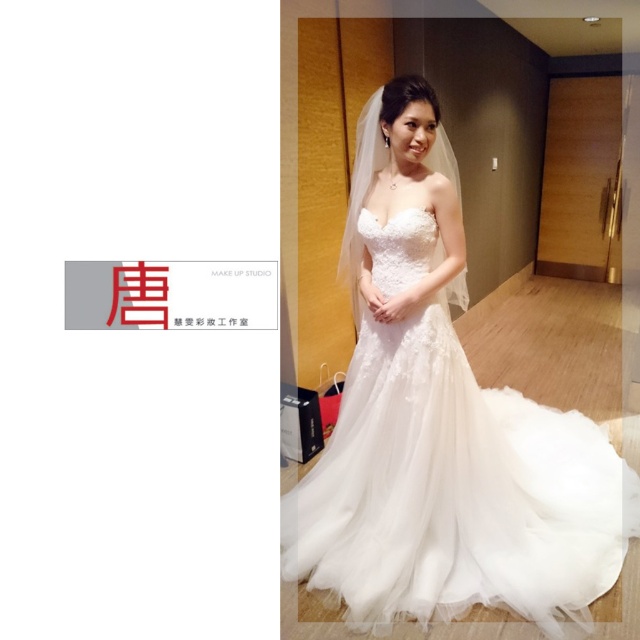
Question: Is white lace dress at center below white lace veil at upper center?

Choices:
 (A) yes
 (B) no

Answer: (A)

Question: Among these objects, which one is nearest to the camera?

Choices:
 (A) white lace dress at center
 (B) white lace veil at upper center

Answer: (A)

Question: Among these objects, which one is farthest from the camera?

Choices:
 (A) white lace dress at center
 (B) white lace veil at upper center

Answer: (B)

Question: Can you confirm if white lace dress at center is positioned below white lace veil at upper center?

Choices:
 (A) yes
 (B) no

Answer: (A)

Question: Can you confirm if white lace dress at center is positioned above white lace veil at upper center?

Choices:
 (A) no
 (B) yes

Answer: (A)